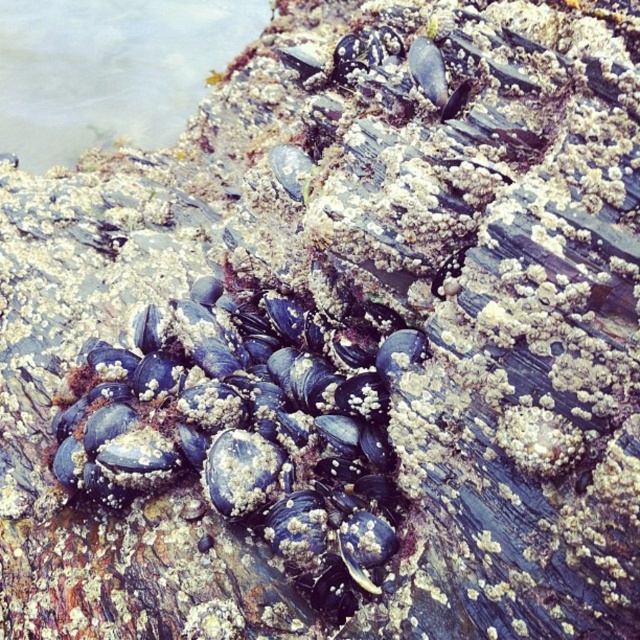
Is blue matte shells at center to the right of clear water at upper left from the viewer's perspective?

Correct, you'll find blue matte shells at center to the right of clear water at upper left.

Based on the photo, which of these two, blue matte shells at center or clear water at upper left, stands taller?

clear water at upper left is taller.

Which is behind, point (282, 300) or point (204, 88)?

The point (204, 88) is more distant.

At what (x,y) coordinates should I click in order to perform the action: click on blue matte shells at center. Please return your answer as a coordinate pair (x, y). Looking at the image, I should click on [250, 433].